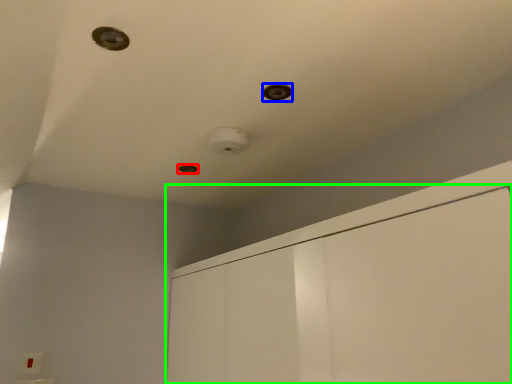
Question: Which object is the farthest from hole (highlighted by a red box)? Choose among these: hole (highlighted by a blue box) or dresser (highlighted by a green box).

Choices:
 (A) hole
 (B) dresser

Answer: (B)